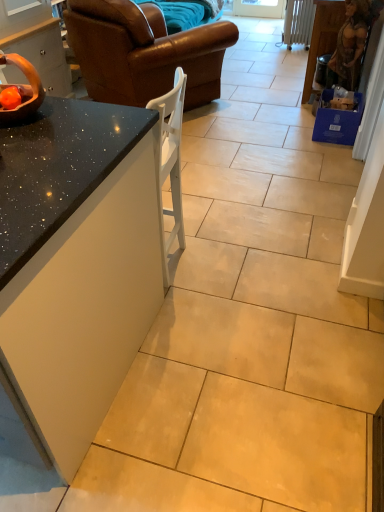
Describe the element at coordinates (144, 52) in the screenshot. This screenshot has height=512, width=384. I see `brown leather couch at upper left` at that location.

This screenshot has width=384, height=512. What do you see at coordinates (23, 90) in the screenshot? I see `wooden bowl at upper left` at bounding box center [23, 90].

Where is `matte black bowl at left, which is counted as the second cabinetry, starting from the right`? matte black bowl at left, which is counted as the second cabinetry, starting from the right is located at coordinates (37, 45).

How much space does black granite countertop at left, the first countertop in the left-to-right sequence, occupy horizontally?

It is 1.01 meters.

Locate an element on the screen. This screenshot has width=384, height=512. black granite countertop at left, which ranks as the second countertop in right-to-left order is located at coordinates (76, 263).

Where is `brown leather couch at upper left`? brown leather couch at upper left is located at coordinates (144, 52).

Measure the distance between wooden statue at right, the 1th cabinetry in the right-to-left sequence, and brown leather couch at upper left.

wooden statue at right, the 1th cabinetry in the right-to-left sequence, and brown leather couch at upper left are 1.25 meters apart.

Find the location of `cabinetry lying above the brown leather couch at upper left (from the image's perspective)`. cabinetry lying above the brown leather couch at upper left (from the image's perspective) is located at coordinates (322, 38).

Between wooden statue at right, the 1th cabinetry in the right-to-left sequence, and brown leather couch at upper left, which one appears on the left side from the viewer's perspective?

brown leather couch at upper left is more to the left.

Which of these two, wooden statue at right, the 1th cabinetry in the right-to-left sequence, or brown leather couch at upper left, is wider?

With larger width is brown leather couch at upper left.

Based on the photo, how different are the orientations of brown leather couch at upper left and wooden statue at right, acting as the 2th cabinetry starting from the left, in degrees?

brown leather couch at upper left and wooden statue at right, acting as the 2th cabinetry starting from the left, are facing 121 degrees away from each other.

Image resolution: width=384 pixels, height=512 pixels. I want to click on cabinetry behind the brown leather couch at upper left, so click(x=322, y=38).

Considering the relative sizes of brown leather couch at upper left and wooden statue at right, acting as the 2th cabinetry starting from the left, in the image provided, is brown leather couch at upper left shorter than wooden statue at right, acting as the 2th cabinetry starting from the left,?

Incorrect, the height of brown leather couch at upper left does not fall short of that of wooden statue at right, acting as the 2th cabinetry starting from the left.

Looking at this image, considering the relative sizes of brown leather couch at upper left and wooden statue at right, acting as the 2th cabinetry starting from the left, in the image provided, is brown leather couch at upper left bigger than wooden statue at right, acting as the 2th cabinetry starting from the left,?

Yes, brown leather couch at upper left is bigger than wooden statue at right, acting as the 2th cabinetry starting from the left.

From the image's perspective, is wooden statue at right, the 1th cabinetry in the right-to-left sequence, located above or below speckled granite countertop at center-left, placed as the 2th countertop when sorted from left to right?

Clearly, from the image's perspective, wooden statue at right, the 1th cabinetry in the right-to-left sequence, is above speckled granite countertop at center-left, placed as the 2th countertop when sorted from left to right.

Considering the sizes of objects wooden statue at right, acting as the 2th cabinetry starting from the left, and speckled granite countertop at center-left, placed as the 2th countertop when sorted from left to right, in the image provided, who is thinner, wooden statue at right, acting as the 2th cabinetry starting from the left, or speckled granite countertop at center-left, placed as the 2th countertop when sorted from left to right,?

speckled granite countertop at center-left, placed as the 2th countertop when sorted from left to right, is thinner.

From a real-world perspective, which object rests below the other?

In real-world perspective, wooden statue at right, the 1th cabinetry in the right-to-left sequence, is lower.

Based on the photo, which object is closer to the camera, wooden statue at right, the 1th cabinetry in the right-to-left sequence, or speckled granite countertop at center-left, placed as the 2th countertop when sorted from left to right?

Positioned in front is speckled granite countertop at center-left, placed as the 2th countertop when sorted from left to right.

In the image, is wooden statue at right, the 1th cabinetry in the right-to-left sequence, positioned in front of or behind matte black bowl at left, which is counted as the second cabinetry, starting from the right?

wooden statue at right, the 1th cabinetry in the right-to-left sequence, is behind matte black bowl at left, which is counted as the second cabinetry, starting from the right.

Does wooden statue at right, acting as the 2th cabinetry starting from the left, have a lesser width compared to matte black bowl at left, which appears as the 1th cabinetry when viewed from the left?

Indeed, wooden statue at right, acting as the 2th cabinetry starting from the left, has a lesser width compared to matte black bowl at left, which appears as the 1th cabinetry when viewed from the left.

Is wooden statue at right, the 1th cabinetry in the right-to-left sequence, not close to matte black bowl at left, which appears as the 1th cabinetry when viewed from the left?

Absolutely, wooden statue at right, the 1th cabinetry in the right-to-left sequence, is distant from matte black bowl at left, which appears as the 1th cabinetry when viewed from the left.

Can you confirm if wooden statue at right, acting as the 2th cabinetry starting from the left, is shorter than matte black bowl at left, which appears as the 1th cabinetry when viewed from the left?

Indeed, wooden statue at right, acting as the 2th cabinetry starting from the left, has a lesser height compared to matte black bowl at left, which appears as the 1th cabinetry when viewed from the left.

From the image's perspective, who appears lower, wooden bowl at upper left or wooden statue at right, acting as the 2th cabinetry starting from the left?

wooden bowl at upper left.

This screenshot has width=384, height=512. I want to click on the 2nd cabinetry behind the wooden bowl at upper left, so click(x=322, y=38).

Considering the sizes of objects wooden bowl at upper left and wooden statue at right, acting as the 2th cabinetry starting from the left, in the image provided, who is shorter, wooden bowl at upper left or wooden statue at right, acting as the 2th cabinetry starting from the left,?

wooden bowl at upper left is shorter.

Can you tell me how much wooden bowl at upper left and wooden statue at right, acting as the 2th cabinetry starting from the left, differ in facing direction?

wooden bowl at upper left and wooden statue at right, acting as the 2th cabinetry starting from the left, are facing 90.5 degrees away from each other.

How different are the orientations of wooden bowl at upper left and brown leather couch at upper left in degrees?

There is a 30.5-degree angle between the facing directions of wooden bowl at upper left and brown leather couch at upper left.

Is wooden bowl at upper left positioned before brown leather couch at upper left?

Yes, wooden bowl at upper left is closer to the viewer.

Which is more to the right, wooden bowl at upper left or brown leather couch at upper left?

brown leather couch at upper left is more to the right.

In the scene shown: Could you tell me if wooden bowl at upper left is turned towards brown leather couch at upper left?

Yes, wooden bowl at upper left is facing brown leather couch at upper left.

Is wooden bowl at upper left not within matte black bowl at left, which is counted as the second cabinetry, starting from the right?

Indeed, wooden bowl at upper left is completely outside matte black bowl at left, which is counted as the second cabinetry, starting from the right.

Does wooden bowl at upper left turn towards matte black bowl at left, which is counted as the second cabinetry, starting from the right?

No, wooden bowl at upper left does not turn towards matte black bowl at left, which is counted as the second cabinetry, starting from the right.

The image size is (384, 512). In order to click on the 1st cabinetry above the wooden bowl at upper left (from the image's perspective) in this screenshot , I will do `click(37, 45)`.

Is wooden bowl at upper left positioned before matte black bowl at left, which is counted as the second cabinetry, starting from the right?

Yes, wooden bowl at upper left is in front of matte black bowl at left, which is counted as the second cabinetry, starting from the right.

Locate an element on the screen. The image size is (384, 512). cabinetry directly beneath the brown leather couch at upper left (from a real-world perspective) is located at coordinates [322, 38].

Locate an element on the screen. cabinetry on the right of brown leather couch at upper left is located at coordinates (322, 38).

Based on their spatial positions, is black granite countertop at left, the first countertop in the left-to-right sequence, or wooden statue at right, acting as the 2th cabinetry starting from the left, closer to speckled granite countertop at center-left, placed as the first countertop when sorted from right to left?

black granite countertop at left, the first countertop in the left-to-right sequence.

Considering their positions, is speckled granite countertop at center-left, placed as the 2th countertop when sorted from left to right, positioned further to brown leather couch at upper left than matte black bowl at left, which is counted as the second cabinetry, starting from the right?

speckled granite countertop at center-left, placed as the 2th countertop when sorted from left to right, lies further to brown leather couch at upper left than the other object.

Looking at the image, which one is located further to wooden statue at right, the 1th cabinetry in the right-to-left sequence, black granite countertop at left, which ranks as the second countertop in right-to-left order, or matte black bowl at left, which appears as the 1th cabinetry when viewed from the left?

Based on the image, black granite countertop at left, which ranks as the second countertop in right-to-left order, appears to be further to wooden statue at right, the 1th cabinetry in the right-to-left sequence.

When comparing their distances from matte black bowl at left, which appears as the 1th cabinetry when viewed from the left, does wooden statue at right, the 1th cabinetry in the right-to-left sequence, or brown leather couch at upper left seem closer?

The object closer to matte black bowl at left, which appears as the 1th cabinetry when viewed from the left, is brown leather couch at upper left.

From the image, which object appears to be nearer to wooden bowl at upper left, wooden statue at right, the 1th cabinetry in the right-to-left sequence, or speckled granite countertop at center-left, placed as the first countertop when sorted from right to left?

speckled granite countertop at center-left, placed as the first countertop when sorted from right to left, lies closer to wooden bowl at upper left than the other object.

Which object lies nearer to the anchor point brown leather couch at upper left, wooden statue at right, the 1th cabinetry in the right-to-left sequence, or wooden bowl at upper left?

wooden statue at right, the 1th cabinetry in the right-to-left sequence, is closer to brown leather couch at upper left.

From the image, which object appears to be nearer to matte black bowl at left, which is counted as the second cabinetry, starting from the right, speckled granite countertop at center-left, placed as the 2th countertop when sorted from left to right, or black granite countertop at left, the first countertop in the left-to-right sequence?

speckled granite countertop at center-left, placed as the 2th countertop when sorted from left to right, is positioned closer to the anchor matte black bowl at left, which is counted as the second cabinetry, starting from the right.

Looking at the image, which one is located closer to brown leather couch at upper left, wooden bowl at upper left or black granite countertop at left, the first countertop in the left-to-right sequence?

The object closer to brown leather couch at upper left is wooden bowl at upper left.

You are a GUI agent. You are given a task and a screenshot of the screen. Output one action in this format:
    pyautogui.click(x=<x>, y=<y>)
    Task: Click on the appliance positioned between black granite countertop at left, the first countertop in the left-to-right sequence, and matte black bowl at left, which appears as the 1th cabinetry when viewed from the left, from near to far
    The image size is (384, 512).
    Given the screenshot: What is the action you would take?
    pos(23,90)

This screenshot has height=512, width=384. Identify the location of cabinetry located between wooden bowl at upper left and brown leather couch at upper left in the depth direction. (37, 45).

Where is `appliance between matte black bowl at left, which is counted as the second cabinetry, starting from the right, and wooden statue at right, the 1th cabinetry in the right-to-left sequence, from left to right`? This screenshot has height=512, width=384. appliance between matte black bowl at left, which is counted as the second cabinetry, starting from the right, and wooden statue at right, the 1th cabinetry in the right-to-left sequence, from left to right is located at coordinates (23, 90).

At what (x,y) coordinates should I click in order to perform the action: click on countertop situated between brown leather couch at upper left and wooden statue at right, the 1th cabinetry in the right-to-left sequence, from left to right. Please return your answer as a coordinate pair (x, y). Looking at the image, I should click on (58, 169).